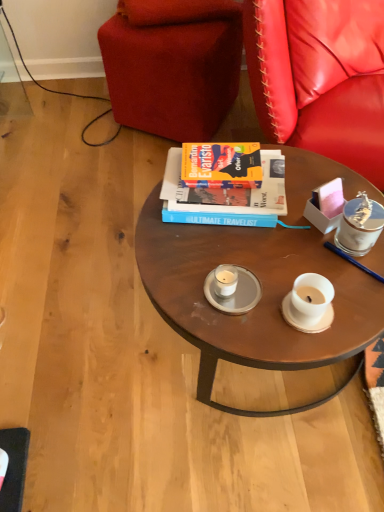
Question: Is velvet red studio couch at upper center completely or partially outside of wooden round table at center?

Choices:
 (A) no
 (B) yes

Answer: (B)

Question: From the image's perspective, is velvet red studio couch at upper center under wooden round table at center?

Choices:
 (A) yes
 (B) no

Answer: (B)

Question: From a real-world perspective, is velvet red studio couch at upper center located higher than wooden round table at center?

Choices:
 (A) yes
 (B) no

Answer: (A)

Question: Can you confirm if velvet red studio couch at upper center is shorter than wooden round table at center?

Choices:
 (A) no
 (B) yes

Answer: (A)

Question: Is velvet red studio couch at upper center to the left of wooden round table at center from the viewer's perspective?

Choices:
 (A) no
 (B) yes

Answer: (B)

Question: Is wooden round table at center in front of or behind clear glass saucer at center in the image?

Choices:
 (A) front
 (B) behind

Answer: (A)

Question: From the image's perspective, is wooden round table at center above or below clear glass saucer at center?

Choices:
 (A) below
 (B) above

Answer: (B)

Question: Based on their sizes in the image, would you say wooden round table at center is bigger or smaller than clear glass saucer at center?

Choices:
 (A) small
 (B) big

Answer: (B)

Question: Is wooden round table at center situated inside clear glass saucer at center or outside?

Choices:
 (A) inside
 (B) outside

Answer: (B)

Question: Looking at their shapes, would you say hardcover book at center is wider or thinner than velvet red studio couch at upper center?

Choices:
 (A) wide
 (B) thin

Answer: (B)

Question: In the image, is hardcover book at center positioned in front of or behind velvet red studio couch at upper center?

Choices:
 (A) front
 (B) behind

Answer: (A)

Question: From a real-world perspective, is hardcover book at center physically located above or below velvet red studio couch at upper center?

Choices:
 (A) below
 (B) above

Answer: (B)

Question: Do you think hardcover book at center is within velvet red studio couch at upper center, or outside of it?

Choices:
 (A) inside
 (B) outside

Answer: (B)

Question: From the image's perspective, is clear glass saucer at center positioned above or below hardcover book at center?

Choices:
 (A) below
 (B) above

Answer: (A)

Question: Relative to hardcover book at center, is clear glass saucer at center in front or behind?

Choices:
 (A) front
 (B) behind

Answer: (A)